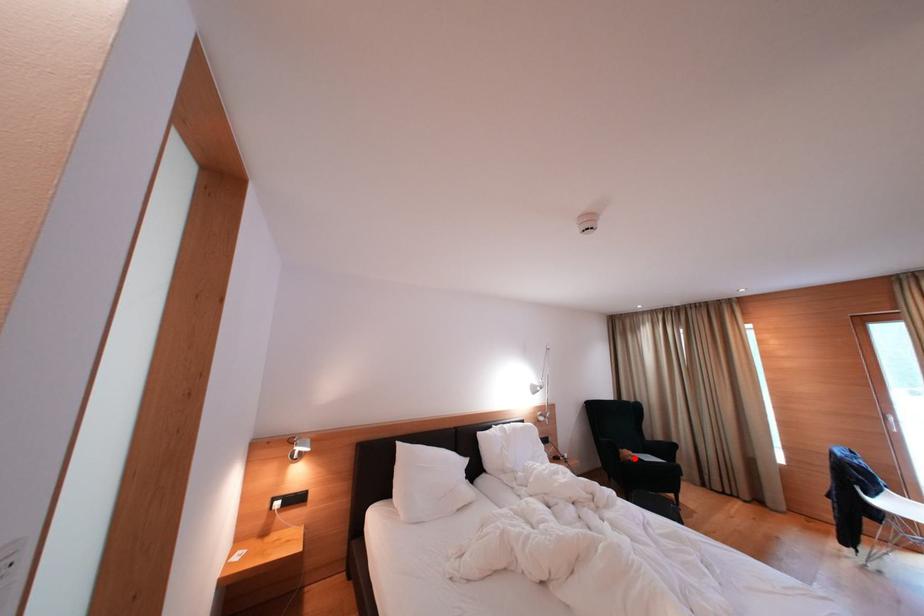
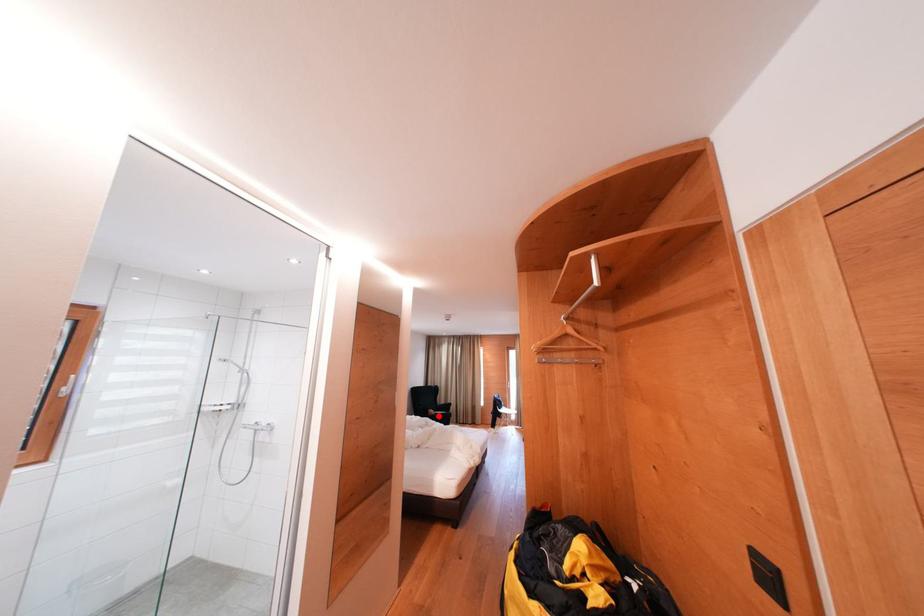
I am providing you with two images of the same scene from different viewpoints. A red point is marked on the first image and another point is marked on the second image. Do the highlighted points in image1 and image2 indicate the same real-world spot?

Yes